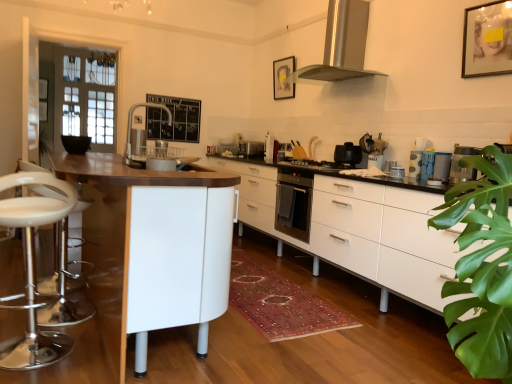
Question: Do you think white matte cabinet at center is within matte plastic cups at right, which is the 2th appliance in bottom-to-top order, or outside of it?

Choices:
 (A) inside
 (B) outside

Answer: (B)

Question: From a real-world perspective, is white matte cabinet at center above or below matte plastic cups at right, which is the fourth appliance in left-to-right order?

Choices:
 (A) below
 (B) above

Answer: (A)

Question: Considering the real-world distances, which object is farthest from the white glossy coffee maker at center, arranged as the third appliance when viewed from the left?

Choices:
 (A) matte plastic cups at right, which is the 2th appliance in bottom-to-top order
 (B) stainless steel range hood at upper center
 (C) satin silver toaster at center, the fourth appliance when ordered from bottom to top
 (D) white matte table at center
 (E) white glossy coffee maker at center, which is the second appliance from left to right

Answer: (D)

Question: Which object is positioned closest to the satin silver toaster at center, the 4th appliance from the right?

Choices:
 (A) matte plastic cups at right, positioned as the 3th appliance in top-to-bottom order
 (B) stainless steel range hood at upper center
 (C) white matte table at center
 (D) white matte cabinet at center
 (E) wooden picture frame at upper right, arranged as the first picture frame when viewed from the right

Answer: (D)